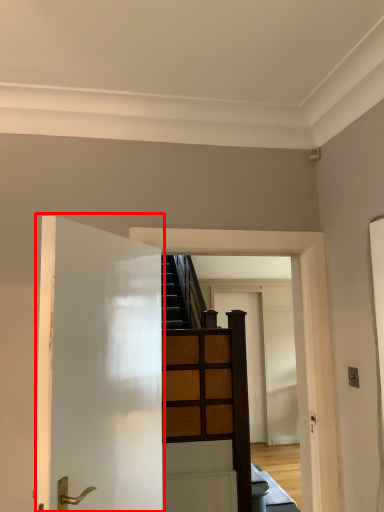
Question: Observing the image, what is the correct spatial positioning of door (annotated by the red box) in reference to door?

Choices:
 (A) right
 (B) left

Answer: (B)